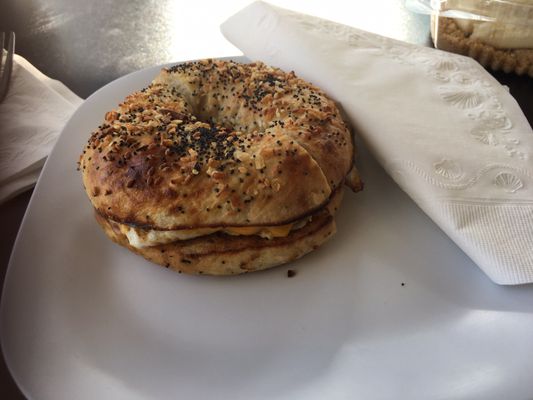
Where is `plate`? The image size is (533, 400). plate is located at coordinates (130, 292).